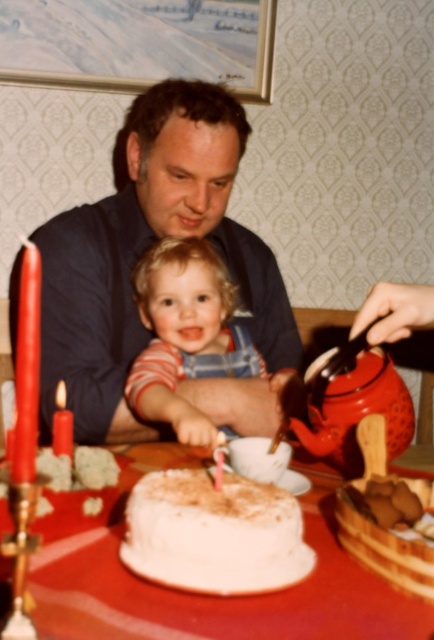
You are a guest at this dining table. You want to pour tea from the matte red teapot at right into a cup. To do this, you need to move the white frosted cake at center. Is the cake smaller than the teapot?

The white frosted cake at center has a smaller size compared to matte red teapot at right, so yes, the cake is smaller than the teapot. You can move it to access the teapot.

You are a chef preparing to serve a dessert. You need to place a red wax candle at left exactly 30 inches away from the matte blue shirt at upper center. Based on the current arrangement, is the candle positioned correctly?

The red wax candle at left is currently 27.22 inches away from the matte blue shirt at upper center, which is 2.78 inches too close. Move it 2.78 inches further away to meet the requirement.